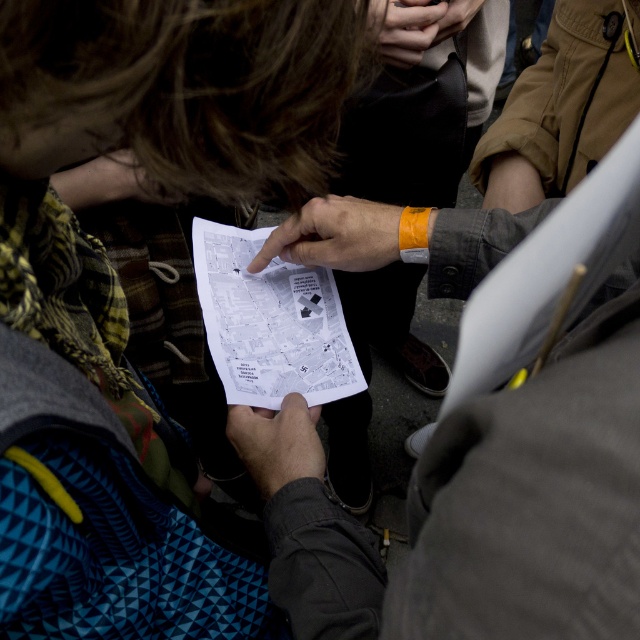
You are trying to determine which object is higher in the image. You see the orange fabric wristband at center and the smooth black paper at center. Which one is taller?

The orange fabric wristband at center is taller than the smooth black paper at center.